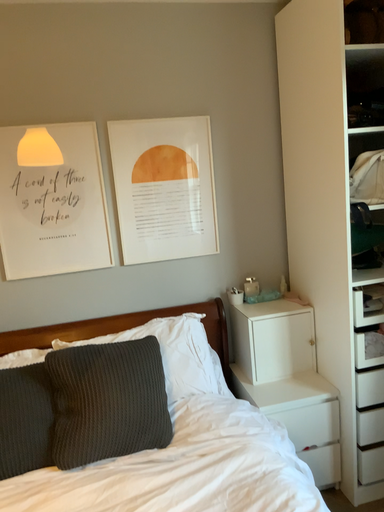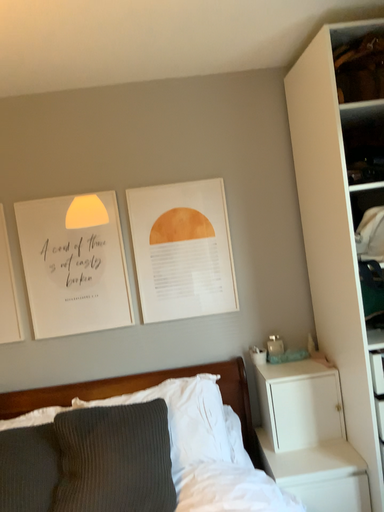
Question: How did the camera likely rotate when shooting the video?

Choices:
 (A) rotated left
 (B) rotated right

Answer: (A)